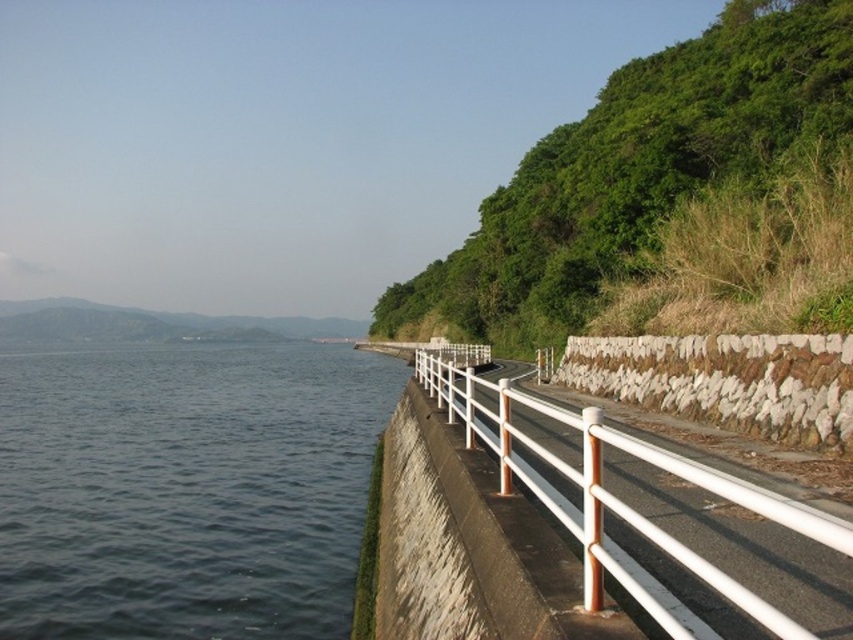
Question: Is dark blue water at left bigger than green leafy hillside at upper right?

Choices:
 (A) yes
 (B) no

Answer: (B)

Question: Is the position of green leafy hillside at upper right more distant than that of white glossy rail at right?

Choices:
 (A) yes
 (B) no

Answer: (A)

Question: Estimate the real-world distances between objects in this image. Which object is farther from the dark blue water at left?

Choices:
 (A) white glossy rail at right
 (B) green leafy hillside at upper right

Answer: (B)

Question: Does dark blue water at left appear under white glossy rail at right?

Choices:
 (A) yes
 (B) no

Answer: (A)

Question: Which object appears farthest from the camera in this image?

Choices:
 (A) green leafy hillside at upper right
 (B) dark blue water at left
 (C) white glossy rail at right

Answer: (A)

Question: Which point appears farthest from the camera in this image?

Choices:
 (A) (16, 572)
 (B) (650, 68)
 (C) (703, 632)

Answer: (B)